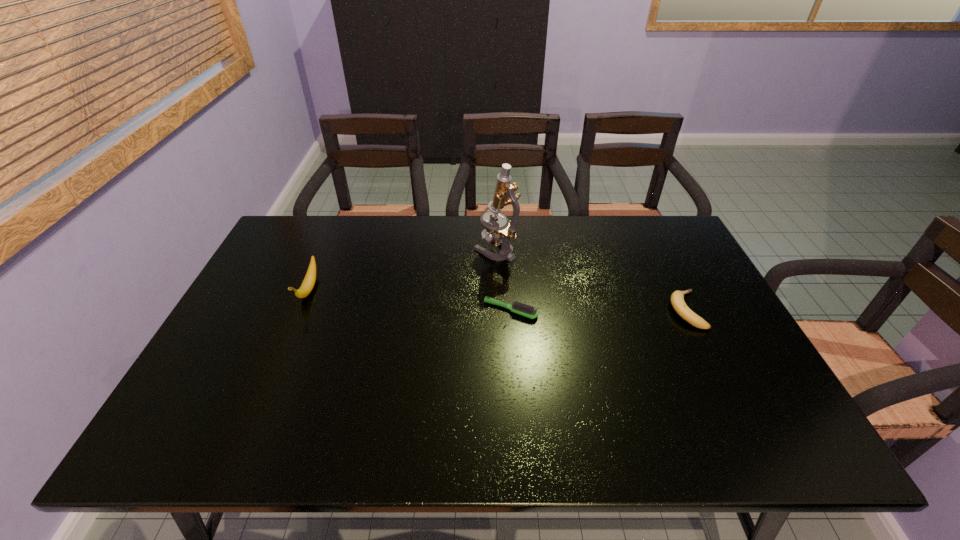
You are a GUI agent. You are given a task and a screenshot of the screen. Output one action in this format:
    pyautogui.click(x=<x>, y=<y>)
    Task: Click on the free space between the second tallest object and the microscope
    The image size is (960, 540).
    Given the screenshot: What is the action you would take?
    pyautogui.click(x=402, y=270)

Where is `free spot between the leftmost object and the shortest object`? The height and width of the screenshot is (540, 960). free spot between the leftmost object and the shortest object is located at coordinates (410, 300).

At what (x,y) coordinates should I click in order to perform the action: click on free space between the microscope and the second tallest object. Please return your answer as a coordinate pair (x, y). The height and width of the screenshot is (540, 960). Looking at the image, I should click on (402, 270).

Locate an element on the screen. free area in between the left banana and the farthest object is located at coordinates (402, 270).

I want to click on blank region between the tallest object and the hairbrush, so click(503, 280).

Find the location of a particular element. vacant space that's between the second tallest object and the tallest object is located at coordinates (402, 270).

Find the location of a particular element. Image resolution: width=960 pixels, height=540 pixels. empty space between the hairbrush and the microscope is located at coordinates (503, 280).

Image resolution: width=960 pixels, height=540 pixels. I want to click on free space between the third tallest object and the microscope, so click(x=590, y=280).

This screenshot has width=960, height=540. I want to click on empty space between the hairbrush and the microscope, so click(503, 280).

At what (x,y) coordinates should I click in order to perform the action: click on vacant space that is in between the shorter banana and the farthest object. Please return your answer as a coordinate pair (x, y). Looking at the image, I should click on (590, 280).